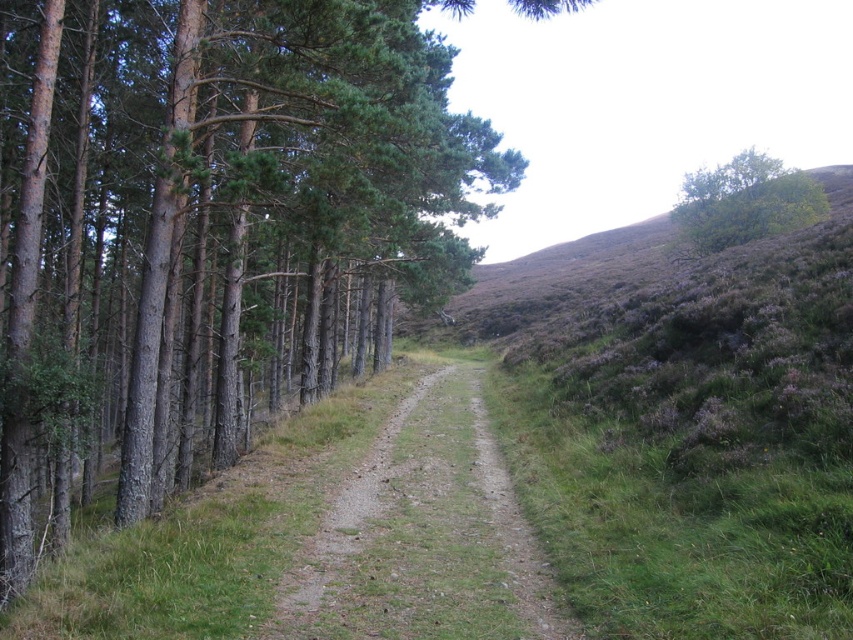
You are a hiker standing at the center of the dirt path in the forest scene. You notice a brown textured tree at left and a green leafy tree at upper right. Which tree is farther away from you?

The brown textured tree at left is 28.64 meters away from the green leafy tree at upper right. Since you are standing between them on the path, the distance from you to each tree would depend on your exact position. However, without specific distances from you to each tree, it is impossible to determine which is farther away based on the given information.